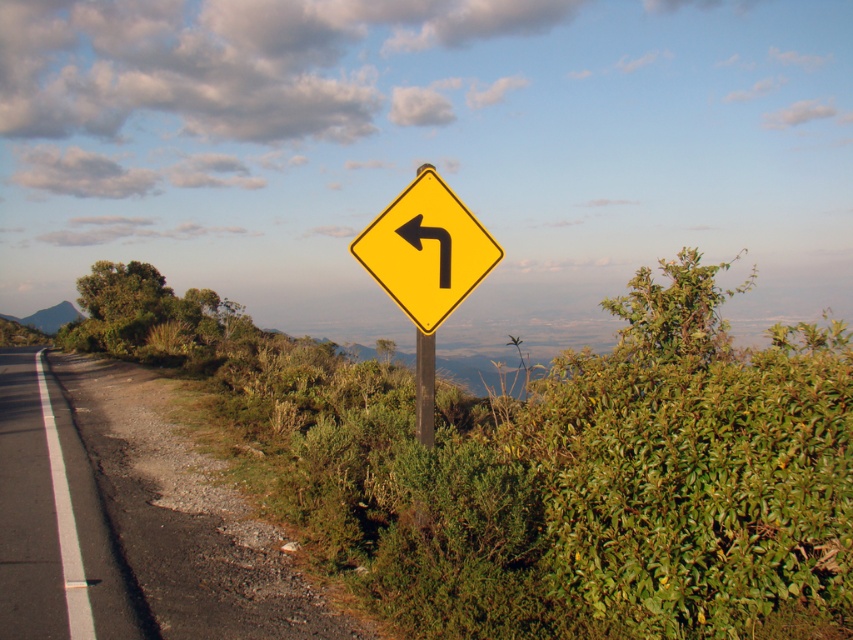
From the picture: Does gravel road at left have a larger size compared to metallic pole at center?

Yes, gravel road at left is bigger than metallic pole at center.

Which is more to the right, gravel road at left or metallic pole at center?

metallic pole at center

Image resolution: width=853 pixels, height=640 pixels. What do you see at coordinates (167, 522) in the screenshot? I see `gravel road at left` at bounding box center [167, 522].

Where is `gravel road at left`? The width and height of the screenshot is (853, 640). gravel road at left is located at coordinates (167, 522).

Can you confirm if yellow plastic diamond-shaped road sign at center is smaller than green grassy hill at left?

No.

Based on the photo, can you confirm if yellow plastic diamond-shaped road sign at center is wider than green grassy hill at left?

Yes, yellow plastic diamond-shaped road sign at center is wider than green grassy hill at left.

Does point (474, 224) come farther from viewer compared to point (39, 317)?

That is False.

Locate an element on the screen. The image size is (853, 640). yellow plastic diamond-shaped road sign at center is located at coordinates (426, 250).

Is gravel road at left to the left of green grassy hill at left from the viewer's perspective?

Incorrect, gravel road at left is not on the left side of green grassy hill at left.

Which of these two, gravel road at left or green grassy hill at left, stands shorter?

green grassy hill at left is shorter.

What do you see at coordinates (167, 522) in the screenshot? I see `gravel road at left` at bounding box center [167, 522].

Where is `gravel road at left`? The image size is (853, 640). gravel road at left is located at coordinates (167, 522).